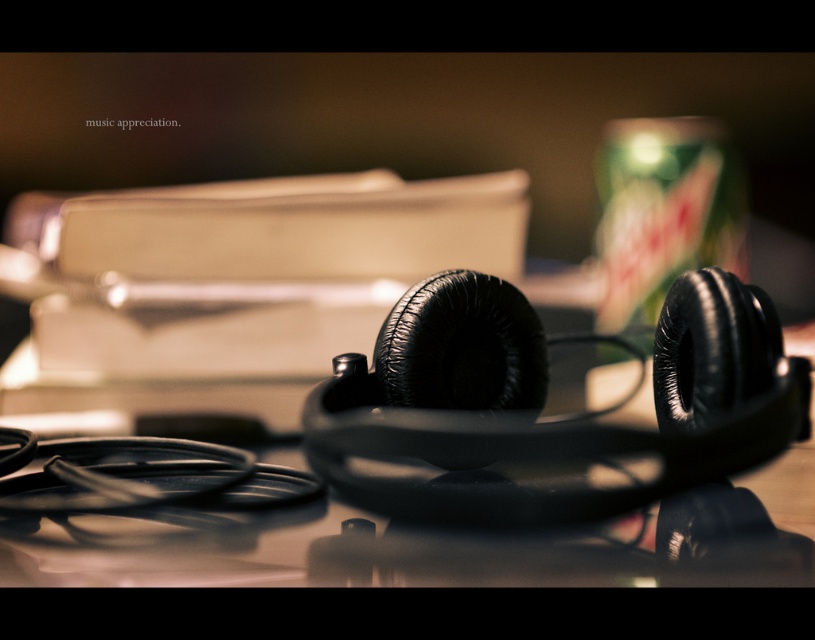
You are a photographer adjusting your camera settings to capture the scene. You want to focus on the black matte headphones at center and the green matte can at upper right. Which object should you focus on first to ensure both are in focus?

The black matte headphones at center is closer to the viewer than the green matte can at upper right. To ensure both are in focus, you should focus on the black matte headphones at center first, as it is the closer object.

You are holding a small toy that is 10 centimeters long. You want to place it on the surface where the black matte headphones at center are resting. Can you estimate if the toy will fit on the surface without overlapping the headphones?

The black matte headphones at center are 38.77 centimeters away from the viewer. Since the toy is only 10 centimeters long, there should be enough space on the surface to place it without overlapping the headphones.